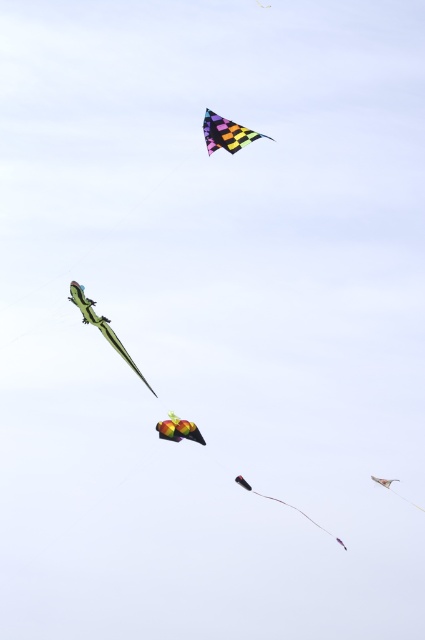
Does shiny metallic fruit at center lie behind metallic silver kite at upper right?

Yes, shiny metallic fruit at center is behind metallic silver kite at upper right.

Can you confirm if shiny metallic fruit at center is smaller than metallic silver kite at upper right?

No.

Describe the element at coordinates (178, 429) in the screenshot. I see `shiny metallic fruit at center` at that location.

Where is `shiny metallic fruit at center`? shiny metallic fruit at center is located at coordinates (x=178, y=429).

At what (x,y) coordinates should I click in order to perform the action: click on green matte lizard at left. Please return your answer as a coordinate pair (x, y). This screenshot has height=640, width=425. Looking at the image, I should click on (102, 326).

Which is more to the left, green matte lizard at left or black matte kite at center?

Positioned to the left is green matte lizard at left.

Is point (73, 291) positioned after point (305, 515)?

Yes, it is.

Where is `green matte lizard at left`? green matte lizard at left is located at coordinates (102, 326).

Does multicolored checkered kite at upper center appear over shiny silver kite at lower right?

Yes, multicolored checkered kite at upper center is above shiny silver kite at lower right.

Can you confirm if multicolored checkered kite at upper center is wider than shiny silver kite at lower right?

Yes.

The width and height of the screenshot is (425, 640). Identify the location of multicolored checkered kite at upper center. tap(226, 132).